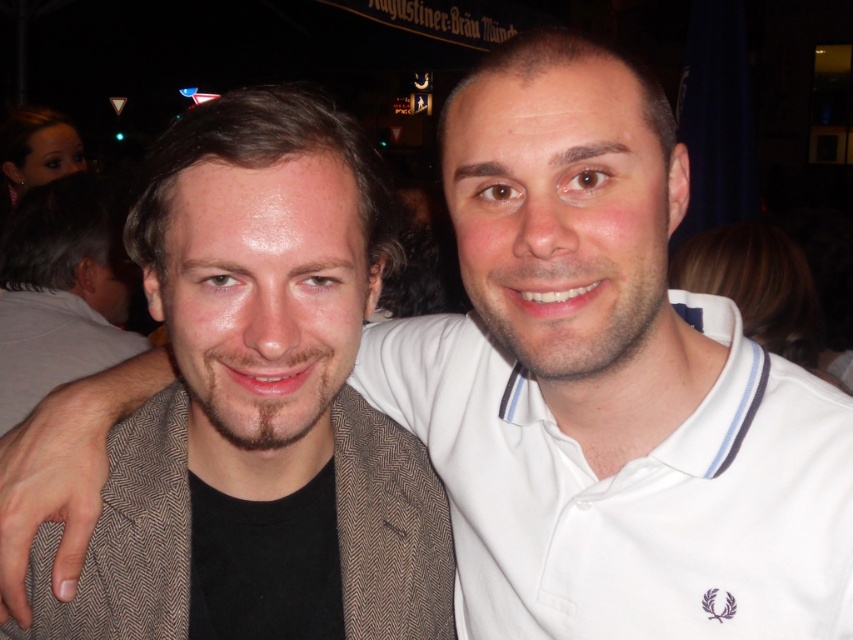
Does brown herringbone blazer at left appear on the left side of white cotton polo shirt at center?

Yes, brown herringbone blazer at left is to the left of white cotton polo shirt at center.

Image resolution: width=853 pixels, height=640 pixels. What do you see at coordinates (262, 396) in the screenshot? I see `brown herringbone blazer at left` at bounding box center [262, 396].

The width and height of the screenshot is (853, 640). What are the coordinates of `brown herringbone blazer at left` in the screenshot? It's located at (262, 396).